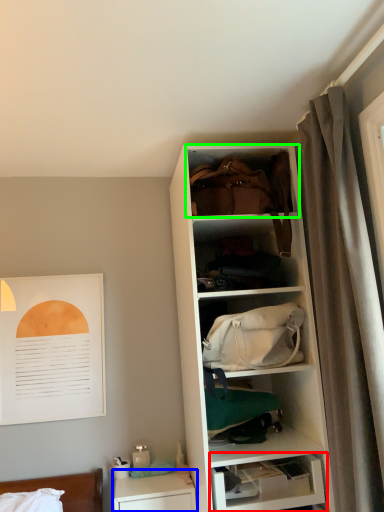
Question: Which object is positioned farthest from shelf (highlighted by a red box)? Select from table (highlighted by a blue box) and cabinet (highlighted by a green box).

Choices:
 (A) table
 (B) cabinet

Answer: (B)